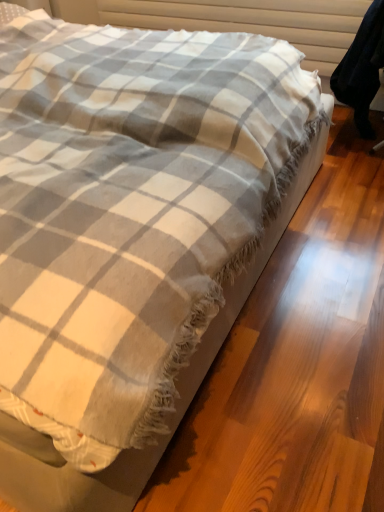
Question: Should I look upward or downward to see dark blue fabric swivel chair at right?

Choices:
 (A) down
 (B) up

Answer: (B)